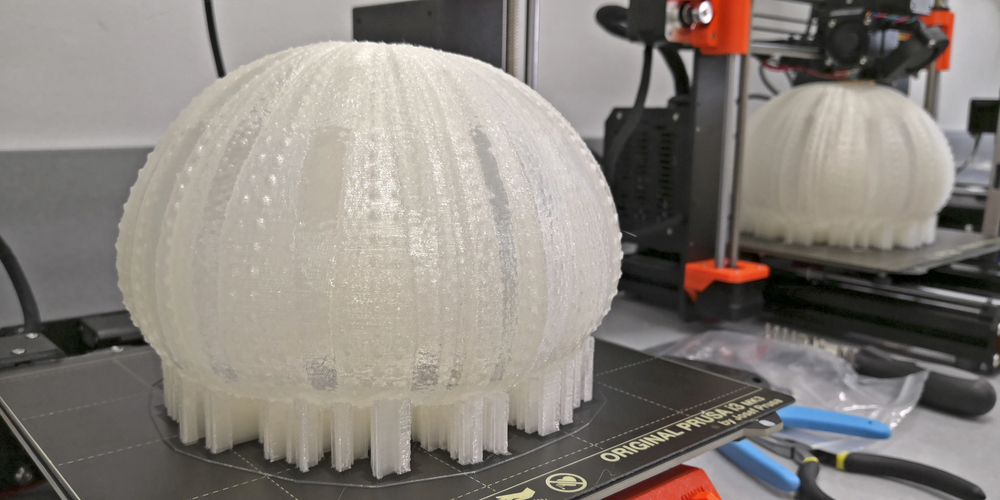
You are a GUI agent. You are given a task and a screenshot of the screen. Output one action in this format:
    pyautogui.click(x=<x>, y=<y>)
    Task: Click on the tabletop
    
    Given the screenshot: What is the action you would take?
    pyautogui.click(x=956, y=438)